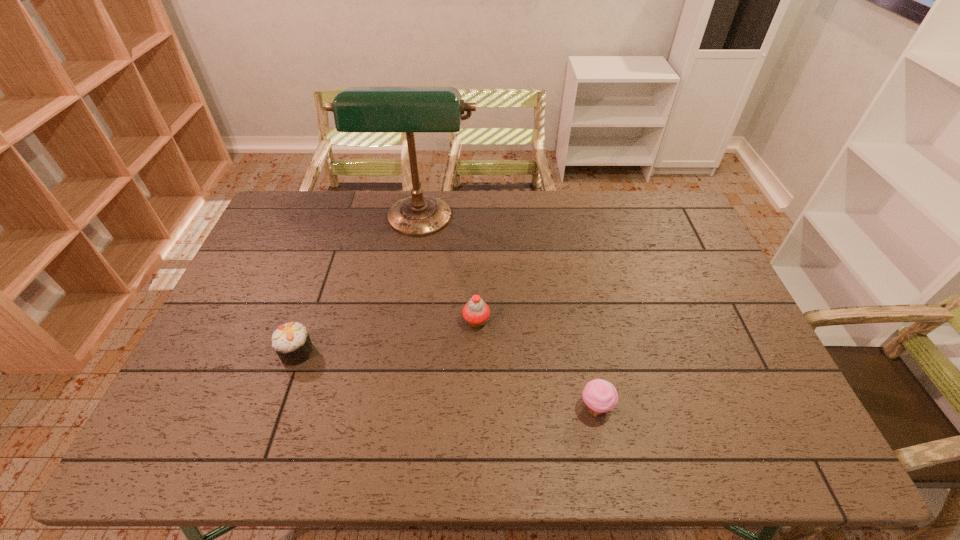
Where is `table lamp`? table lamp is located at coordinates (357, 109).

Identify the location of the tallest object. The width and height of the screenshot is (960, 540). (357, 109).

Where is `the farthest cupcake`? the farthest cupcake is located at coordinates (476, 312).

Locate an element on the screen. The image size is (960, 540). the second cupcake from right to left is located at coordinates (476, 312).

Find the location of a particular element. The image size is (960, 540). the second nearest object is located at coordinates (291, 341).

Locate an element on the screen. The width and height of the screenshot is (960, 540). the leftmost cupcake is located at coordinates (291, 341).

Locate an element on the screen. The height and width of the screenshot is (540, 960). the nearest cupcake is located at coordinates (600, 396).

The height and width of the screenshot is (540, 960). I want to click on the nearest object, so click(600, 396).

Find the location of a particular element. free space located above the green lampshade of the table lamp is located at coordinates (407, 299).

The width and height of the screenshot is (960, 540). I want to click on vacant space located 0.340m on the left of the farthest cupcake, so click(x=344, y=321).